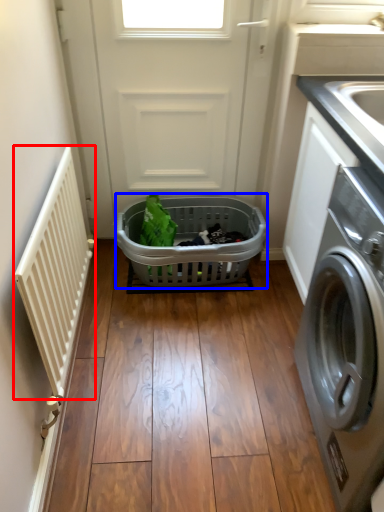
Question: Among these objects, which one is nearest to the camera, balustrade (highlighted by a red box) or basket (highlighted by a blue box)?

Choices:
 (A) balustrade
 (B) basket

Answer: (A)